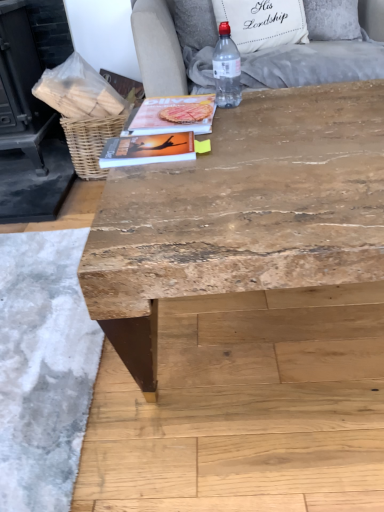
Where is `free space to the right of matte orange book at center, the first magazine positioned from the bottom`? Image resolution: width=384 pixels, height=512 pixels. free space to the right of matte orange book at center, the first magazine positioned from the bottom is located at coordinates (232, 152).